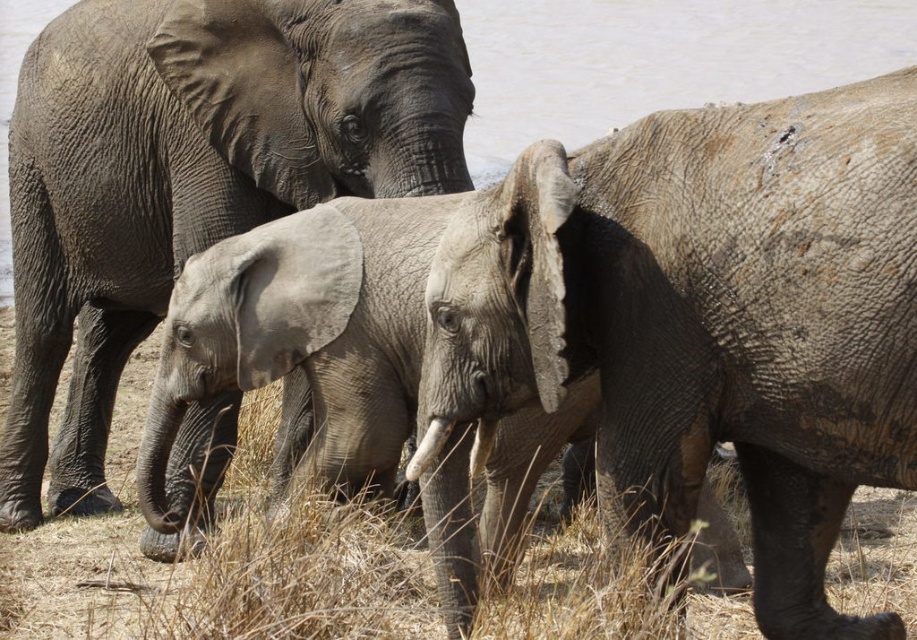
You are a wildlife photographer planning to capture a photo of the gray matte elephant at center and the gray water at upper center. Based on their sizes in the image, which object would require a wider angle lens to include fully in the frame?

The gray matte elephant at center has a greater width than the gray water at upper center, so it would require a wider angle lens to include fully in the frame.

You are a wildlife photographer aiming to capture a clear shot of the gray rough elephant at center and the gray matte elephant at center. Which one is closer to the camera?

The gray rough elephant at center is closer to the camera because it is in front of the gray matte elephant at center.

You are a wildlife photographer aiming to capture a photo of the gray rough elephant at center and the gray matte elephant at center. From your current position, which elephant is positioned to the right of the other?

The gray rough elephant at center is positioned on the right side of the gray matte elephant at center, so it is to the right of the latter.